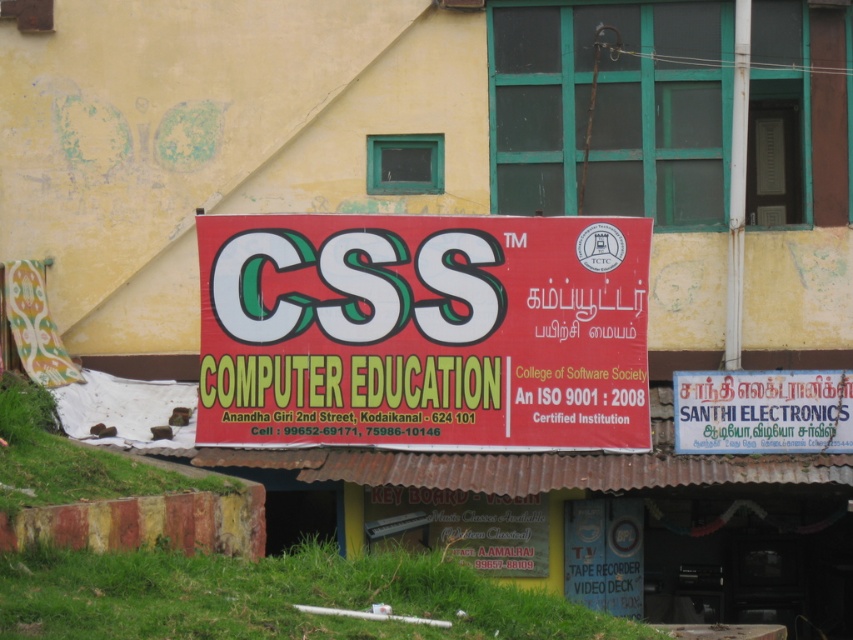
Identify the location of red matte signboard at center. (422, 330).

Which is more to the left, red matte signboard at center or white painted signboard at center?

From the viewer's perspective, red matte signboard at center appears more on the left side.

Where is `red matte signboard at center`? This screenshot has height=640, width=853. red matte signboard at center is located at coordinates (422, 330).